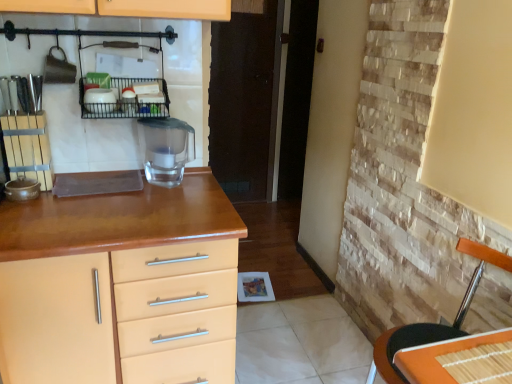
I want to click on free point below transparent glass water filter at center (from a real-world perspective), so click(165, 186).